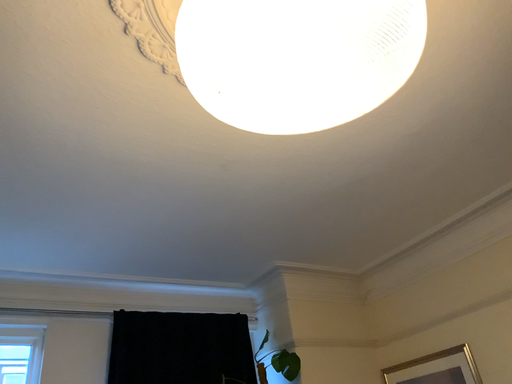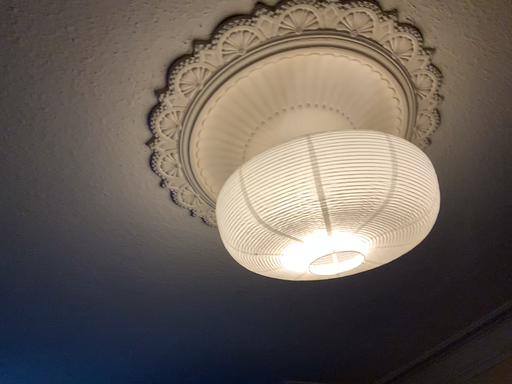
Question: Which way did the camera rotate in the video?

Choices:
 (A) rotated upward
 (B) rotated downward

Answer: (A)